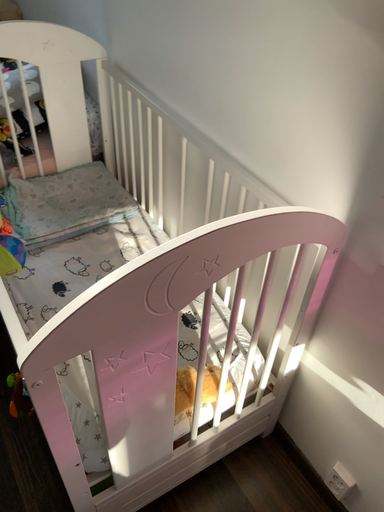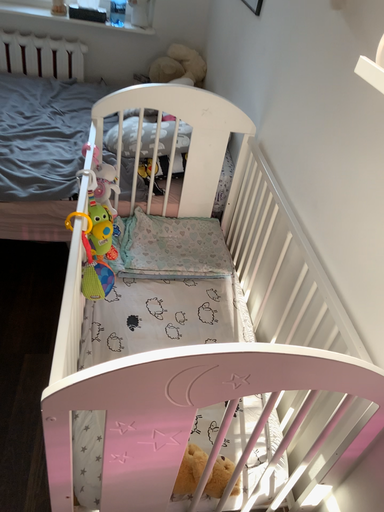
Question: Which way did the camera rotate in the video?

Choices:
 (A) rotated left
 (B) rotated right

Answer: (A)